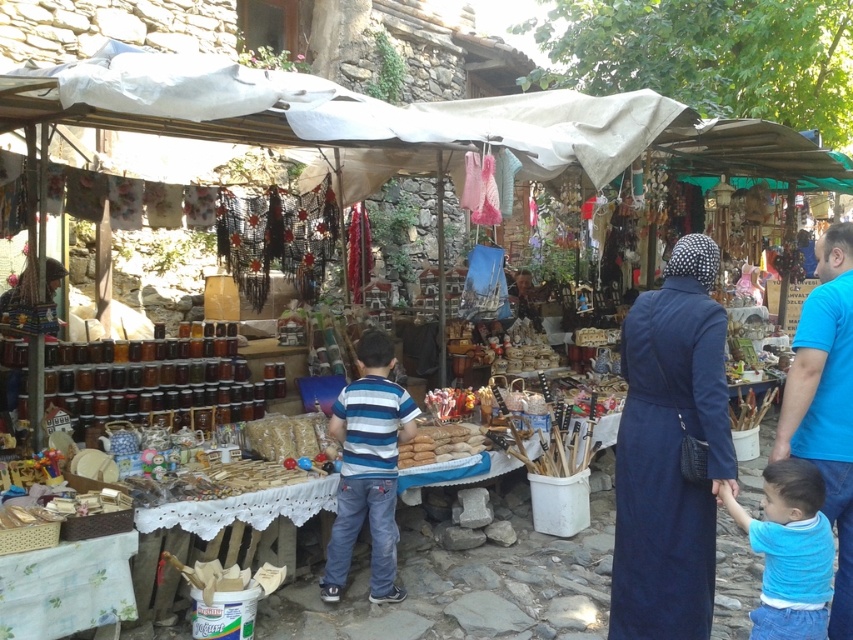
Can you confirm if blue cotton shirt at right is shorter than blue cotton shirt at lower right?

In fact, blue cotton shirt at right may be taller than blue cotton shirt at lower right.

In order to click on blue cotton shirt at right in this screenshot , I will do `click(825, 403)`.

Which is behind, point (849, 552) or point (764, 632)?

Point (849, 552)

Where is `blue cotton shirt at right`? The width and height of the screenshot is (853, 640). blue cotton shirt at right is located at coordinates (825, 403).

Can you confirm if blue cotton shirt at right is smaller than striped cotton shirt at center?

Incorrect, blue cotton shirt at right is not smaller in size than striped cotton shirt at center.

Can you confirm if blue cotton shirt at right is positioned above striped cotton shirt at center?

Yes.

Image resolution: width=853 pixels, height=640 pixels. Identify the location of blue cotton shirt at right. (825, 403).

Describe the element at coordinates (670, 452) in the screenshot. I see `navy blue fabric dress at center` at that location.

Describe the element at coordinates (670, 452) in the screenshot. The height and width of the screenshot is (640, 853). I see `navy blue fabric dress at center` at that location.

Identify the location of navy blue fabric dress at center. This screenshot has height=640, width=853. (670, 452).